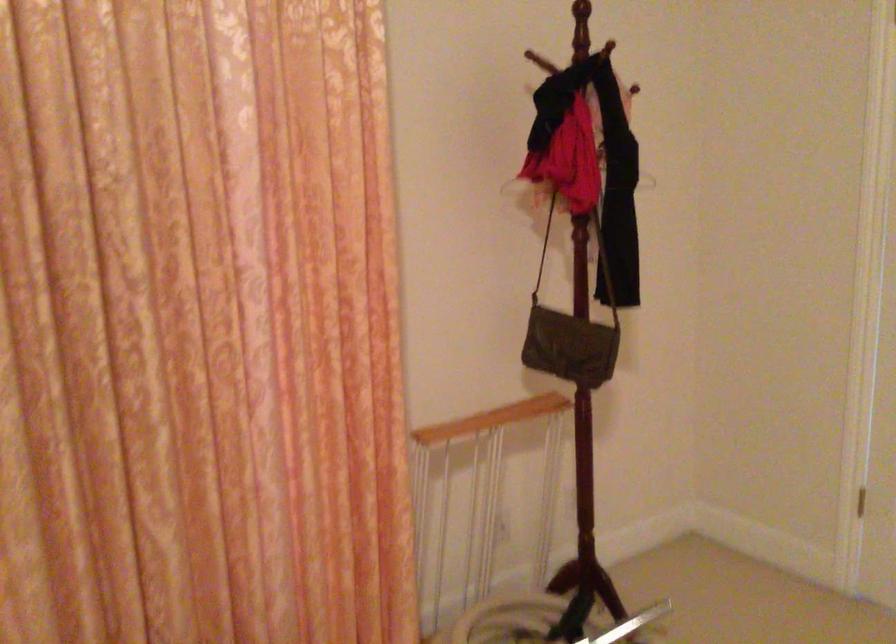
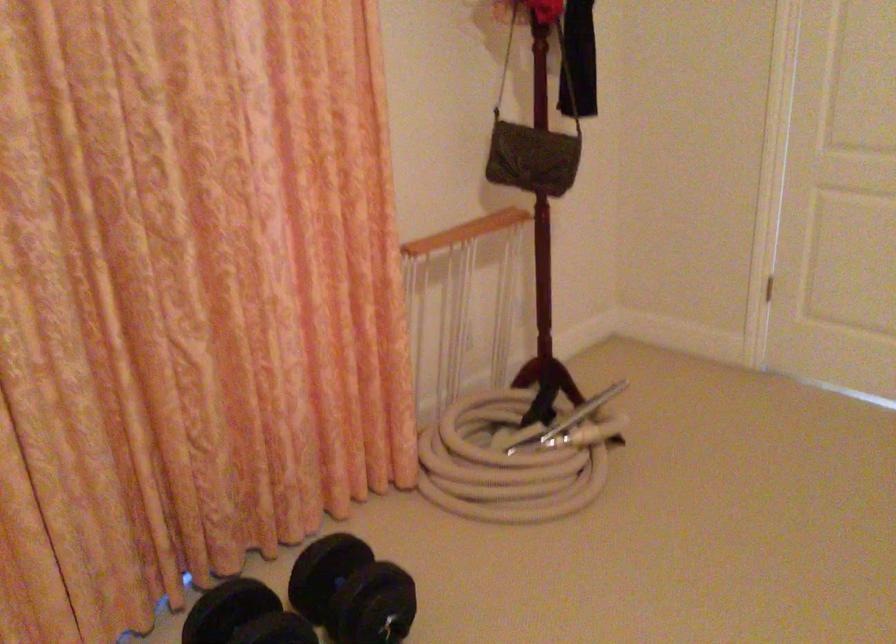
Question: The first image is from the beginning of the video and the second image is from the end. How did the camera likely rotate when shooting the video?

Choices:
 (A) Left
 (B) Right
 (C) Up
 (D) Down

Answer: (B)